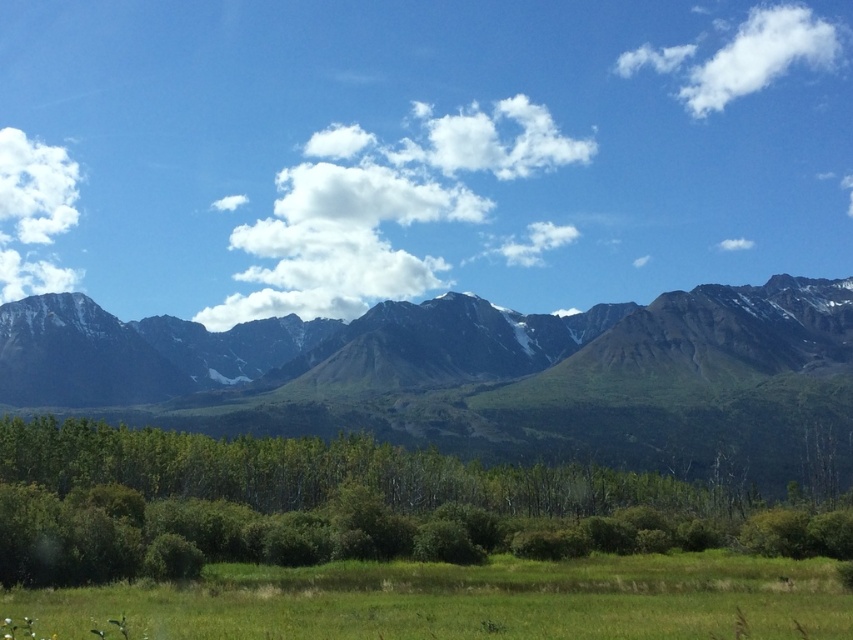
Who is lower down, green leafy trees at lower center or white fluffy cloud at upper right?

Positioned lower is green leafy trees at lower center.

This screenshot has width=853, height=640. What are the coordinates of `green leafy trees at lower center` in the screenshot? It's located at (341, 504).

I want to click on green leafy trees at lower center, so click(x=341, y=504).

The image size is (853, 640). In order to click on green leafy trees at lower center in this screenshot , I will do `click(341, 504)`.

Based on the photo, is the position of white fluffy cloud at upper right less distant than that of white fluffy cloud at upper left?

No, white fluffy cloud at upper right is further to the viewer.

Which is behind, point (674, 67) or point (39, 145)?

Positioned behind is point (39, 145).

Locate an element on the screen. Image resolution: width=853 pixels, height=640 pixels. white fluffy cloud at upper right is located at coordinates (763, 54).

Can you confirm if green grassy mountain range at center is smaller than green grassy field at lower center?

Actually, green grassy mountain range at center might be larger than green grassy field at lower center.

Does point (370, 356) lie behind point (509, 608)?

Yes, it is.

Locate an element on the screen. The image size is (853, 640). green grassy mountain range at center is located at coordinates (389, 342).